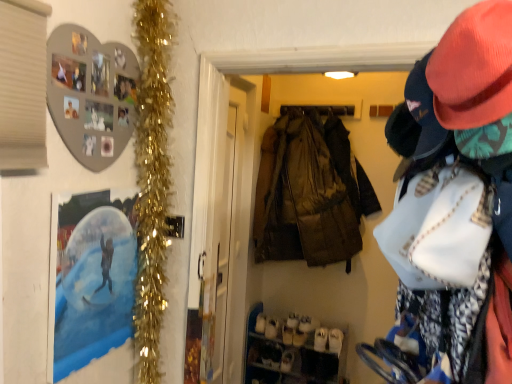
Locate an element on the screen. This screenshot has height=384, width=512. transparent plastic screen door at center is located at coordinates (218, 249).

Find the location of a particular element. Image resolution: width=512 pixels, height=384 pixels. matte pink hat at upper right is located at coordinates (454, 208).

In the scene shown: Measure the distance between white matte shoe rack at lower center and camera.

white matte shoe rack at lower center and camera are 2.67 meters apart from each other.

Measure the distance between metallic silver photo frame at left and camera.

A distance of 4.31 feet exists between metallic silver photo frame at left and camera.

What do you see at coordinates (310, 192) in the screenshot? I see `camouflage fabric jacket at center` at bounding box center [310, 192].

Describe the element at coordinates (290, 329) in the screenshot. I see `white suede shoe at lower center, the 2th shoe in the right-to-left sequence` at that location.

This screenshot has height=384, width=512. I want to click on gold tinsel garland at left, so click(x=152, y=177).

Is gold tinsel garland at left not near white matte shoe rack at lower center?

Yes.

From their relative heights in the image, would you say gold tinsel garland at left is taller or shorter than white matte shoe rack at lower center?

Considering their sizes, gold tinsel garland at left has more height than white matte shoe rack at lower center.

From the image's perspective, which object appears higher, gold tinsel garland at left or white matte shoe rack at lower center?

gold tinsel garland at left, from the image's perspective.

The width and height of the screenshot is (512, 384). I want to click on shelf behind the gold tinsel garland at left, so click(293, 351).

Is white matte shoe rack at lower center looking in the opposite direction of gold tinsel garland at left?

That's not correct — white matte shoe rack at lower center is not looking away from gold tinsel garland at left.

Image resolution: width=512 pixels, height=384 pixels. In order to click on shelf behind the gold tinsel garland at left in this screenshot , I will do `click(293, 351)`.

How different are the orientations of white matte shoe rack at lower center and gold tinsel garland at left in degrees?

90.6 degrees.

From the image's perspective, is white matte shoe rack at lower center located above gold tinsel garland at left?

No, from the image's perspective, white matte shoe rack at lower center is not above gold tinsel garland at left.

From the image's perspective, which one is positioned lower, metallic silver photo frame at left or matte pink hat at upper right?

metallic silver photo frame at left, from the image's perspective.

Between metallic silver photo frame at left and matte pink hat at upper right, which one has larger size?

matte pink hat at upper right is bigger.

The height and width of the screenshot is (384, 512). I want to click on person in front of the metallic silver photo frame at left, so click(454, 208).

Is metallic silver photo frame at left positioned behind matte pink hat at upper right?

Yes, metallic silver photo frame at left is further from the camera.

Is white suede shoe at lower center, which is the second shoe from left to right, facing towards camouflage fabric jacket at center?

No, white suede shoe at lower center, which is the second shoe from left to right, is not turned towards camouflage fabric jacket at center.

From a real-world perspective, is white suede shoe at lower center, the first shoe viewed from the right, above or below camouflage fabric jacket at center?

white suede shoe at lower center, the first shoe viewed from the right, is situated lower than camouflage fabric jacket at center in the real world.

Consider the image. Is white suede shoe at lower center, the first shoe viewed from the right, next to camouflage fabric jacket at center?

white suede shoe at lower center, the first shoe viewed from the right, and camouflage fabric jacket at center are not in contact.

Consider the image. From the image's perspective, is white suede shoe at lower center, which is the second shoe from left to right, located above or below camouflage fabric jacket at center?

Based on their image positions, white suede shoe at lower center, which is the second shoe from left to right, is located beneath camouflage fabric jacket at center.

Could transparent plastic screen door at center be considered to be inside white suede shoe at lower center, the 2th shoe in the right-to-left sequence?

Actually, transparent plastic screen door at center is outside white suede shoe at lower center, the 2th shoe in the right-to-left sequence.

Considering the sizes of white suede shoe at lower center, marked as the 1th shoe in a left-to-right arrangement, and transparent plastic screen door at center in the image, is white suede shoe at lower center, marked as the 1th shoe in a left-to-right arrangement, taller or shorter than transparent plastic screen door at center?

Considering their sizes, white suede shoe at lower center, marked as the 1th shoe in a left-to-right arrangement, has less height than transparent plastic screen door at center.

Between point (295, 314) and point (211, 360), which one is positioned behind?

The point (295, 314) is behind.

Based on the photo, considering the sizes of white suede shoe at lower center, marked as the 1th shoe in a left-to-right arrangement, and gold tinsel garland at left in the image, is white suede shoe at lower center, marked as the 1th shoe in a left-to-right arrangement, bigger or smaller than gold tinsel garland at left?

white suede shoe at lower center, marked as the 1th shoe in a left-to-right arrangement, is smaller than gold tinsel garland at left.

In terms of width, does white suede shoe at lower center, marked as the 1th shoe in a left-to-right arrangement, look wider or thinner when compared to gold tinsel garland at left?

Clearly, white suede shoe at lower center, marked as the 1th shoe in a left-to-right arrangement, has more width compared to gold tinsel garland at left.

Between white suede shoe at lower center, the 2th shoe in the right-to-left sequence, and gold tinsel garland at left, which one appears on the left side from the viewer's perspective?

gold tinsel garland at left.

Does white matte shoe rack at lower center have a smaller size compared to transparent plastic screen door at center?

No, white matte shoe rack at lower center is not smaller than transparent plastic screen door at center.

From the image's perspective, between white matte shoe rack at lower center and transparent plastic screen door at center, who is located below?

From the image's view, white matte shoe rack at lower center is below.

Is white matte shoe rack at lower center shorter than transparent plastic screen door at center?

Yes.

Is point (256, 332) positioned after point (206, 334)?

Yes.

The height and width of the screenshot is (384, 512). I want to click on shelf on the right side of gold tinsel garland at left, so coord(293,351).

Locate an element on the screen. The width and height of the screenshot is (512, 384). shelf below the gold tinsel garland at left (from the image's perspective) is located at coordinates click(x=293, y=351).

Based on their spatial positions, is transparent plastic screen door at center or matte pink hat at upper right closer to white matte shoe rack at lower center?

The object closer to white matte shoe rack at lower center is transparent plastic screen door at center.

Based on their spatial positions, is transparent plastic screen door at center or camouflage fabric jacket at center further from metallic silver photo frame at left?

The object further to metallic silver photo frame at left is camouflage fabric jacket at center.

Which object lies further to the anchor point white suede shoe at lower center, the first shoe viewed from the right, transparent plastic screen door at center or white matte shoe rack at lower center?

transparent plastic screen door at center lies further to white suede shoe at lower center, the first shoe viewed from the right, than the other object.

Looking at the image, which one is located further to gold tinsel garland at left, white suede shoe at lower center, which is the second shoe from left to right, or matte pink hat at upper right?

Among the two, white suede shoe at lower center, which is the second shoe from left to right, is located further to gold tinsel garland at left.

Looking at the image, which one is located closer to gold tinsel garland at left, transparent plastic screen door at center or white suede shoe at lower center, marked as the 1th shoe in a left-to-right arrangement?

transparent plastic screen door at center is closer to gold tinsel garland at left.

Looking at this image, which object lies further to the anchor point white suede shoe at lower center, marked as the 1th shoe in a left-to-right arrangement, transparent plastic screen door at center or metallic silver photo frame at left?

Among the two, metallic silver photo frame at left is located further to white suede shoe at lower center, marked as the 1th shoe in a left-to-right arrangement.

When comparing their distances from transparent plastic screen door at center, does matte pink hat at upper right or gold tinsel garland at left seem closer?

Among the two, gold tinsel garland at left is located nearer to transparent plastic screen door at center.

Looking at the image, which one is located further to white suede shoe at lower center, marked as the 1th shoe in a left-to-right arrangement, transparent plastic screen door at center or matte pink hat at upper right?

matte pink hat at upper right is further to white suede shoe at lower center, marked as the 1th shoe in a left-to-right arrangement.

The height and width of the screenshot is (384, 512). Find the location of `shoe between matte pink hat at upper right and white suede shoe at lower center, the 2th shoe in the right-to-left sequence, from front to back`. shoe between matte pink hat at upper right and white suede shoe at lower center, the 2th shoe in the right-to-left sequence, from front to back is located at coordinates (302, 331).

Where is `screen door between metallic silver photo frame at left and white suede shoe at lower center, the 2th shoe in the right-to-left sequence, along the z-axis`? The height and width of the screenshot is (384, 512). screen door between metallic silver photo frame at left and white suede shoe at lower center, the 2th shoe in the right-to-left sequence, along the z-axis is located at coordinates (218, 249).

Where is `jacket located between gold tinsel garland at left and white suede shoe at lower center, the 2th shoe in the right-to-left sequence, in the depth direction`? Image resolution: width=512 pixels, height=384 pixels. jacket located between gold tinsel garland at left and white suede shoe at lower center, the 2th shoe in the right-to-left sequence, in the depth direction is located at coordinates (310, 192).

The width and height of the screenshot is (512, 384). Identify the location of christmas decoration between metallic silver photo frame at left and white matte shoe rack at lower center in the front-back direction. (152, 177).